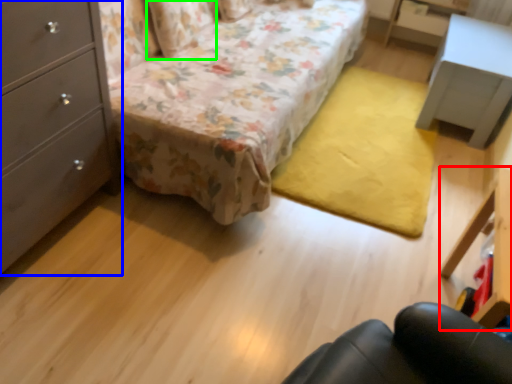
Question: Which object is positioned closest to vanity (highlighted by a red box)? Select from chest of drawers (highlighted by a blue box) and pillow (highlighted by a green box).

Choices:
 (A) chest of drawers
 (B) pillow

Answer: (A)